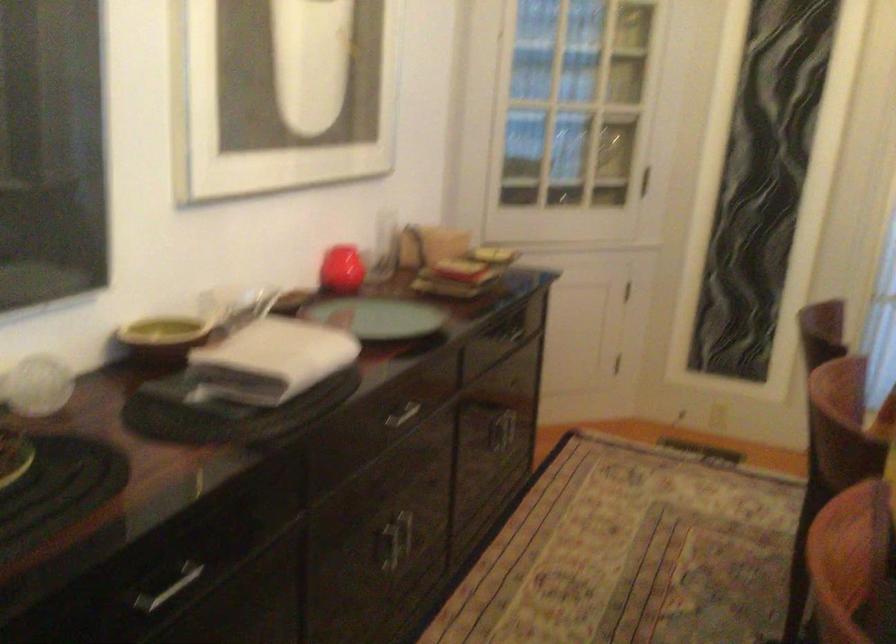
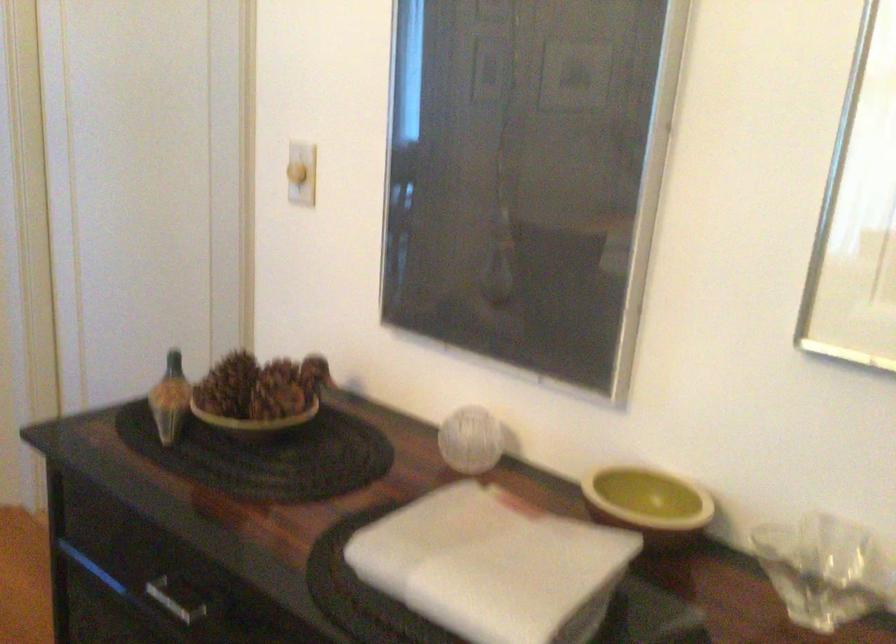
In the second image, find the point that corresponds to the point at 92,384 in the first image.

(470, 440)